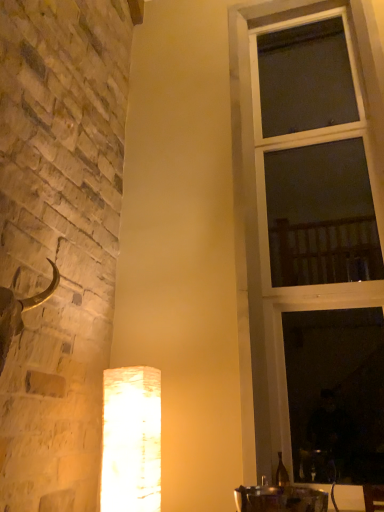
Question: From the image's perspective, is clear glass window at right on top of white textured lamp at lower center?

Choices:
 (A) no
 (B) yes

Answer: (B)

Question: Considering the relative positions of clear glass window at right and white textured lamp at lower center in the image provided, is clear glass window at right to the left of white textured lamp at lower center from the viewer's perspective?

Choices:
 (A) no
 (B) yes

Answer: (A)

Question: Are clear glass window at right and white textured lamp at lower center beside each other?

Choices:
 (A) no
 (B) yes

Answer: (A)

Question: Can you confirm if clear glass window at right is taller than white textured lamp at lower center?

Choices:
 (A) yes
 (B) no

Answer: (A)

Question: From a real-world perspective, does clear glass window at right stand above white textured lamp at lower center?

Choices:
 (A) no
 (B) yes

Answer: (B)

Question: Can you confirm if clear glass window at right is bigger than white textured lamp at lower center?

Choices:
 (A) no
 (B) yes

Answer: (B)

Question: Is white textured lamp at lower center looking in the opposite direction of clear glass window at right?

Choices:
 (A) no
 (B) yes

Answer: (A)

Question: Considering the relative sizes of white textured lamp at lower center and clear glass window at right in the image provided, is white textured lamp at lower center thinner than clear glass window at right?

Choices:
 (A) yes
 (B) no

Answer: (B)

Question: Does white textured lamp at lower center contain clear glass window at right?

Choices:
 (A) yes
 (B) no

Answer: (B)

Question: Is white textured lamp at lower center with clear glass window at right?

Choices:
 (A) yes
 (B) no

Answer: (B)

Question: From a real-world perspective, is white textured lamp at lower center under clear glass window at right?

Choices:
 (A) yes
 (B) no

Answer: (A)

Question: Can you confirm if white textured lamp at lower center is bigger than clear glass window at right?

Choices:
 (A) no
 (B) yes

Answer: (A)

Question: Considering the positions of white textured lamp at lower center and clear glass window at right in the image, is white textured lamp at lower center wider or thinner than clear glass window at right?

Choices:
 (A) thin
 (B) wide

Answer: (B)